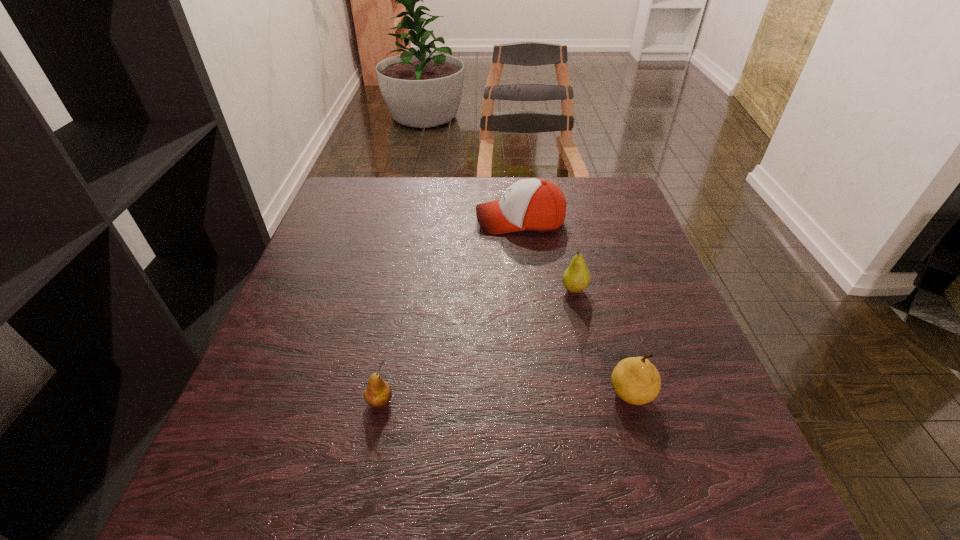
Find the location of a particular element. The width and height of the screenshot is (960, 540). the second farthest object is located at coordinates (576, 277).

Identify the location of baseball cap. This screenshot has width=960, height=540. (538, 205).

At what (x,y) coordinates should I click in order to perform the action: click on the shortest pear. Please return your answer as a coordinate pair (x, y). The image size is (960, 540). Looking at the image, I should click on (378, 393).

Image resolution: width=960 pixels, height=540 pixels. Find the location of `the shortest object`. the shortest object is located at coordinates (x=378, y=393).

You are a GUI agent. You are given a task and a screenshot of the screen. Output one action in this format:
    pyautogui.click(x=<x>, y=<y>)
    Task: Click on the vacant area located 0.250m on the left of the farthest pear
    The image size is (960, 540).
    Given the screenshot: What is the action you would take?
    pyautogui.click(x=447, y=290)

This screenshot has height=540, width=960. In order to click on free location located on the front-facing side of the farthest object in this screenshot , I will do `click(363, 221)`.

This screenshot has width=960, height=540. In order to click on vacant space located 0.300m on the front-facing side of the farthest object in this screenshot , I will do pyautogui.click(x=363, y=221).

Where is `free spot located on the front-facing side of the farthest object`? free spot located on the front-facing side of the farthest object is located at coordinates (340, 221).

Image resolution: width=960 pixels, height=540 pixels. In order to click on vacant point located 0.130m on the left of the leftmost object in this screenshot , I will do `click(292, 402)`.

Find the location of `object that is at the far edge`. object that is at the far edge is located at coordinates (538, 205).